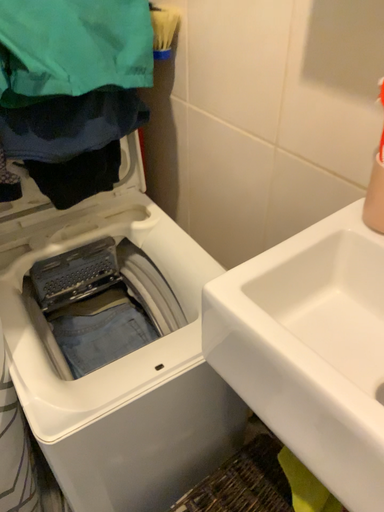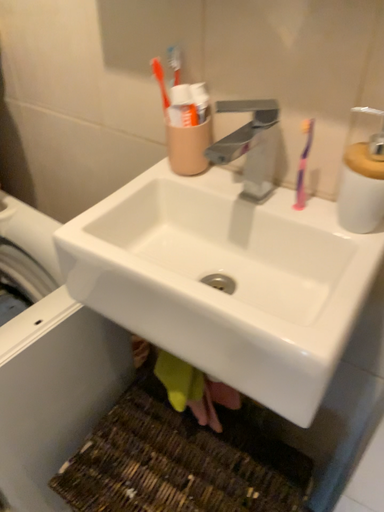
Question: Which way did the camera rotate in the video?

Choices:
 (A) rotated left
 (B) rotated right

Answer: (B)